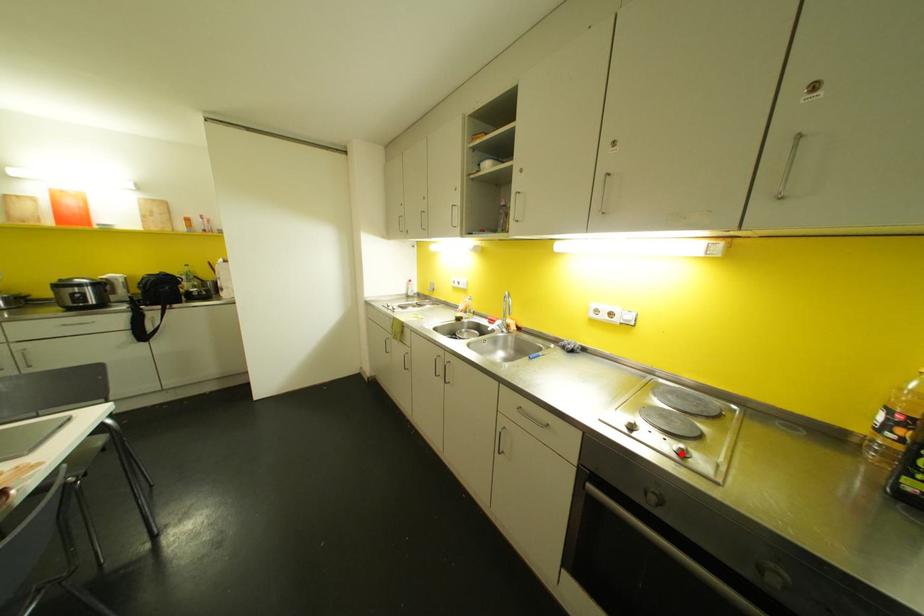
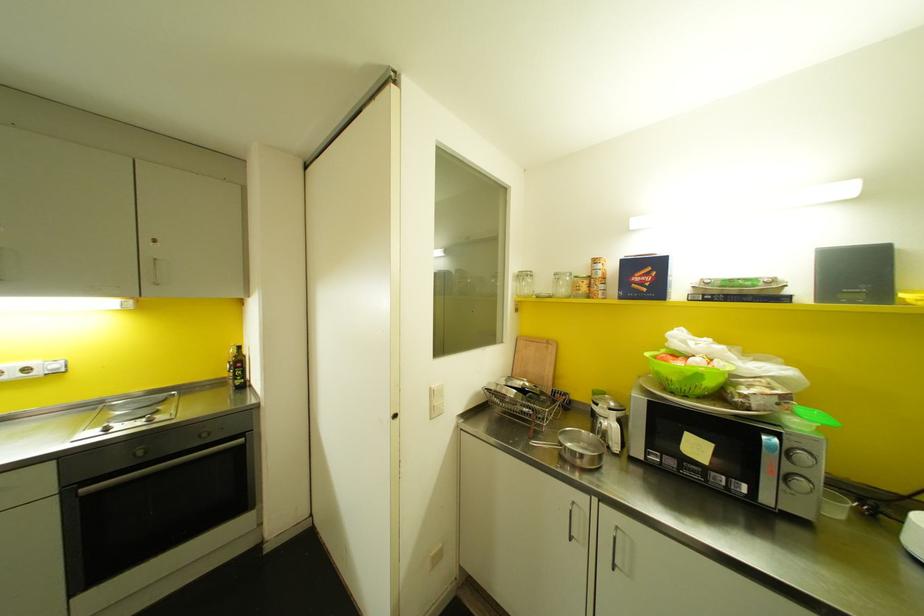
In the second image, find the point that corresponds to the highlighted location in the first image.

(150, 419)